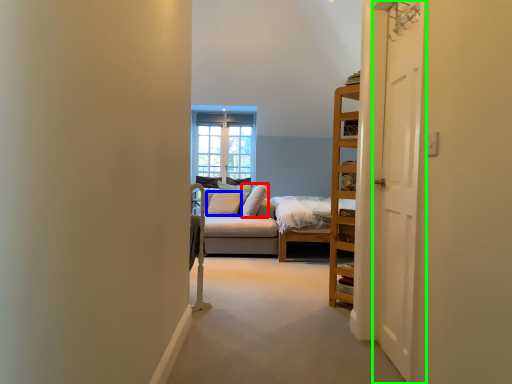
Question: Which object is positioned closest to pillow (highlighted by a red box)? Select from pillow (highlighted by a blue box) and door (highlighted by a green box).

Choices:
 (A) pillow
 (B) door

Answer: (A)